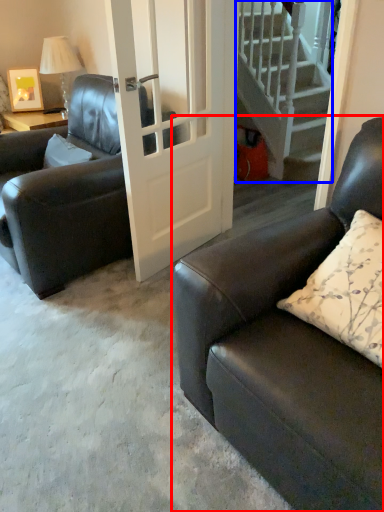
Question: Which object appears closest to the camera in this image, studio couch (highlighted by a red box) or stairs (highlighted by a blue box)?

Choices:
 (A) studio couch
 (B) stairs

Answer: (A)